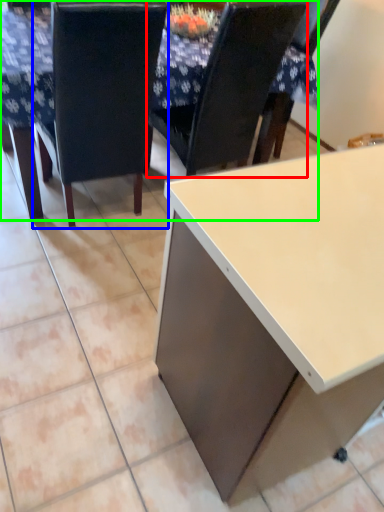
Question: Which object is the closest to the chair (highlighted by a red box)? Choose among these: chair (highlighted by a blue box) or table (highlighted by a green box).

Choices:
 (A) chair
 (B) table

Answer: (A)